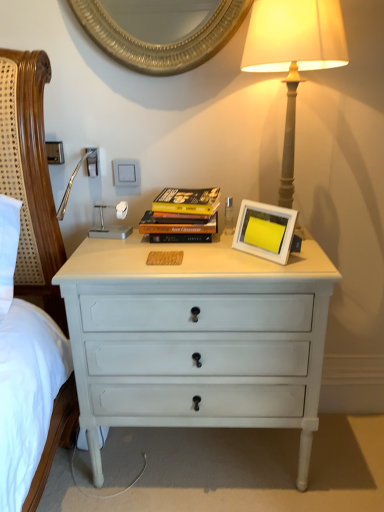
Question: Considering the relative positions of white matte picture frame at center and matte gray lamp at upper right in the image provided, is white matte picture frame at center to the left or to the right of matte gray lamp at upper right?

Choices:
 (A) left
 (B) right

Answer: (A)

Question: Is white matte picture frame at center spatially inside matte gray lamp at upper right, or outside of it?

Choices:
 (A) outside
 (B) inside

Answer: (B)

Question: Considering the real-world distances, which object is farthest from the white painted wood chest of drawers at center?

Choices:
 (A) white matte picture frame at center
 (B) matte gray lamp at upper right
 (C) hardcover books at center

Answer: (B)

Question: Which is farther from the matte gray lamp at upper right?

Choices:
 (A) hardcover books at center
 (B) white painted wood chest of drawers at center
 (C) white matte picture frame at center

Answer: (B)